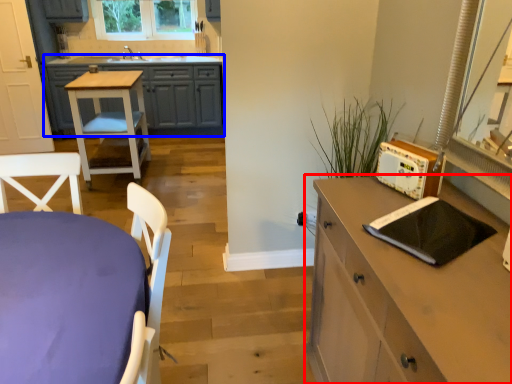
Question: Which object appears farthest to the camera in this image, chest of drawers (highlighted by a red box) or cabinetry (highlighted by a blue box)?

Choices:
 (A) chest of drawers
 (B) cabinetry

Answer: (B)